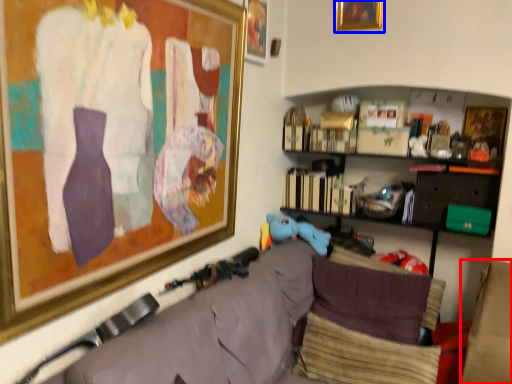
Question: Which point is further to the camera, furniture (highlighted by a red box) or picture frame (highlighted by a blue box)?

Choices:
 (A) furniture
 (B) picture frame

Answer: (B)